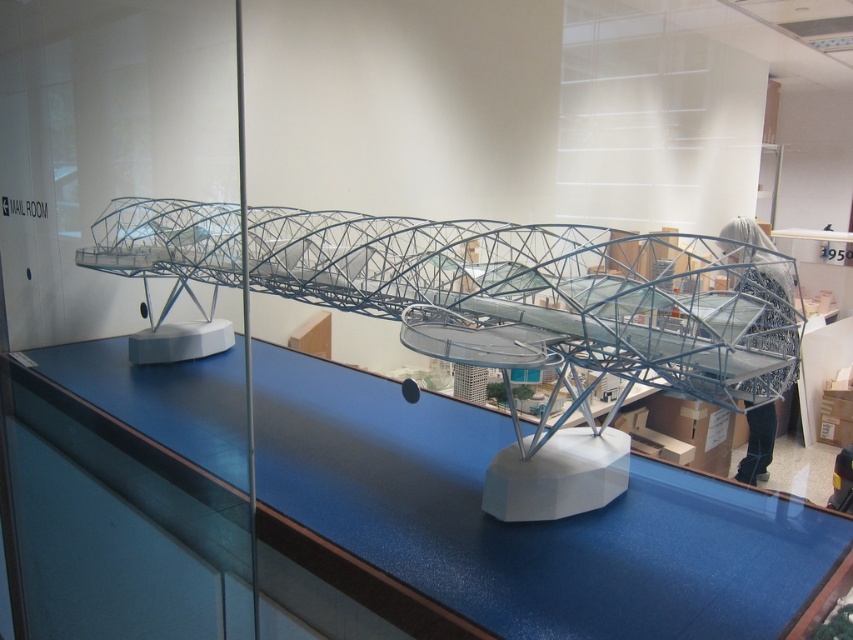
Question: Which is farther from the metallic wireframe bridge at center?

Choices:
 (A) metallic wireframe bridge at right
 (B) transparent glass table at center

Answer: (A)

Question: Estimate the real-world distances between objects in this image. Which object is farther from the transparent glass table at center?

Choices:
 (A) metallic wireframe bridge at right
 (B) metallic wireframe bridge at center

Answer: (A)

Question: Does transparent glass table at center appear on the left side of metallic wireframe bridge at right?

Choices:
 (A) yes
 (B) no

Answer: (A)

Question: Does metallic wireframe bridge at center come in front of metallic wireframe bridge at right?

Choices:
 (A) yes
 (B) no

Answer: (A)

Question: Which point is farther from the camera taking this photo?

Choices:
 (A) (759, 272)
 (B) (263, 499)

Answer: (A)

Question: Is metallic wireframe bridge at center to the left of metallic wireframe bridge at right from the viewer's perspective?

Choices:
 (A) yes
 (B) no

Answer: (A)